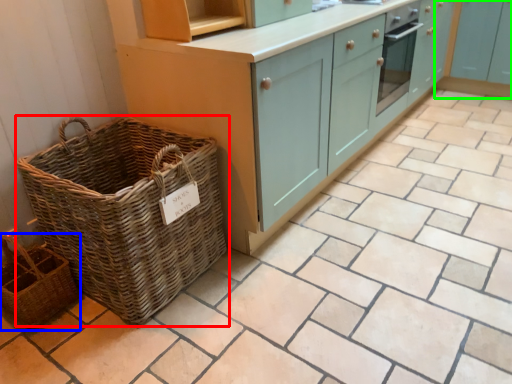
Question: Considering the real-world distances, which object is farthest from picnic basket (highlighted by a red box)? basket (highlighted by a blue box) or cabinetry (highlighted by a green box)?

Choices:
 (A) basket
 (B) cabinetry

Answer: (B)